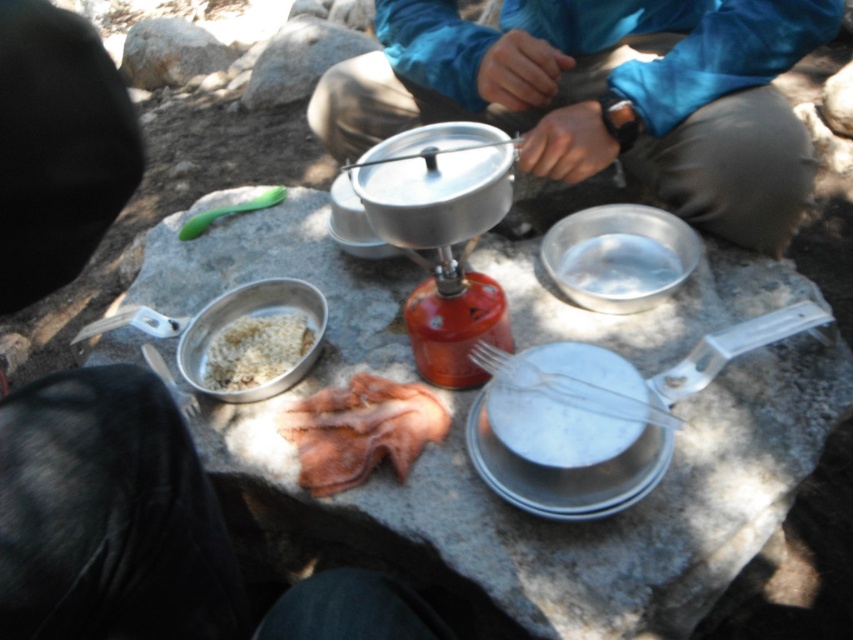
Question: Does brushed metal cooking set at center have a greater width compared to white matte rice at center left?

Choices:
 (A) no
 (B) yes

Answer: (B)

Question: Which object is positioned closest to the white matte rice at center left?

Choices:
 (A) blue fabric jacket at upper center
 (B) pink fabric at center

Answer: (B)

Question: Which point is closer to the camera?

Choices:
 (A) pink fabric at center
 (B) blue fabric jacket at upper center

Answer: (A)

Question: Can you confirm if brushed metal cooking set at center is smaller than pink fabric at center?

Choices:
 (A) no
 (B) yes

Answer: (A)

Question: Is brushed metal cooking set at center in front of white matte rice at center left?

Choices:
 (A) yes
 (B) no

Answer: (A)

Question: Which object is positioned closest to the brushed metal cooking set at center?

Choices:
 (A) blue fabric jacket at upper center
 (B) pink fabric at center

Answer: (B)